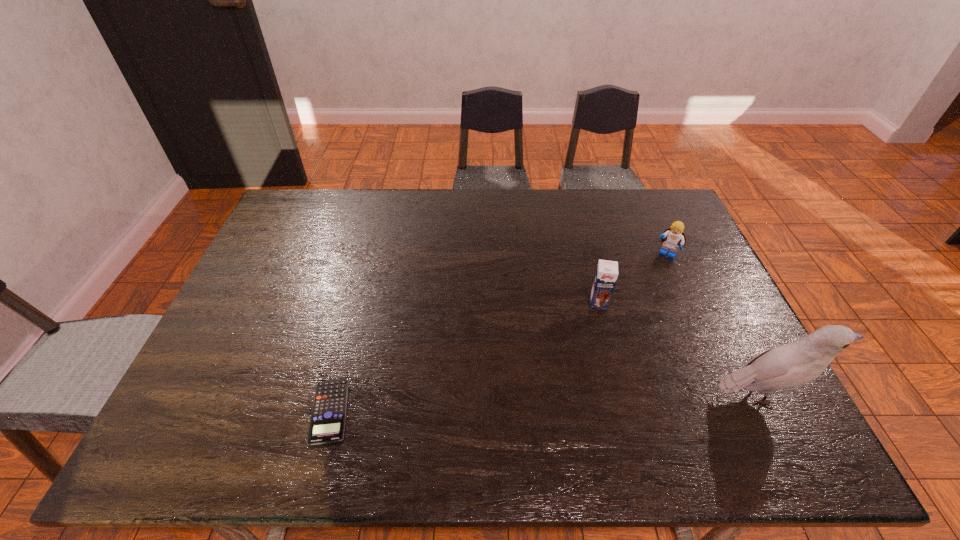
Locate an element on the screen. The image size is (960, 540). vacant area that lies between the calculator and the farthest object is located at coordinates (498, 333).

Identify the location of unoccupied position between the chocolate milk and the Lego. This screenshot has width=960, height=540. (632, 278).

I want to click on free space between the calculator and the farthest object, so click(x=498, y=333).

You are a GUI agent. You are given a task and a screenshot of the screen. Output one action in this format:
    pyautogui.click(x=<x>, y=<y>)
    Task: Click on the empty location between the shortest object and the third shortest object
    
    Given the screenshot: What is the action you would take?
    465,357

Image resolution: width=960 pixels, height=540 pixels. Identify the location of unoccupied area between the third nearest object and the Lego. (632, 278).

Locate an element on the screen. object that is the third closest one to the second farthest object is located at coordinates (327, 424).

Identify which object is located as the nearest to the second shortest object. Please provide its 2D coordinates. Your answer should be formatted as a tuple, i.e. [(x, y)], where the tuple contains the x and y coordinates of a point satisfying the conditions above.

[(606, 275)]

This screenshot has width=960, height=540. I want to click on free point that satisfies the following two spatial constraints: 1. on the front side of the bird; 2. at the beak of the third tallest object, so click(x=728, y=395).

You are a GUI agent. You are given a task and a screenshot of the screen. Output one action in this format:
    pyautogui.click(x=<x>, y=<y>)
    Task: Click on the vacant space that satisfies the following two spatial constraints: 1. on the front side of the farthest object; 2. at the beak of the tallest object
    The image size is (960, 540).
    Given the screenshot: What is the action you would take?
    pyautogui.click(x=728, y=395)

The image size is (960, 540). Find the location of `vacant space that satisfies the following two spatial constraints: 1. on the front side of the bird; 2. at the beak of the Lego`. vacant space that satisfies the following two spatial constraints: 1. on the front side of the bird; 2. at the beak of the Lego is located at coordinates (728, 395).